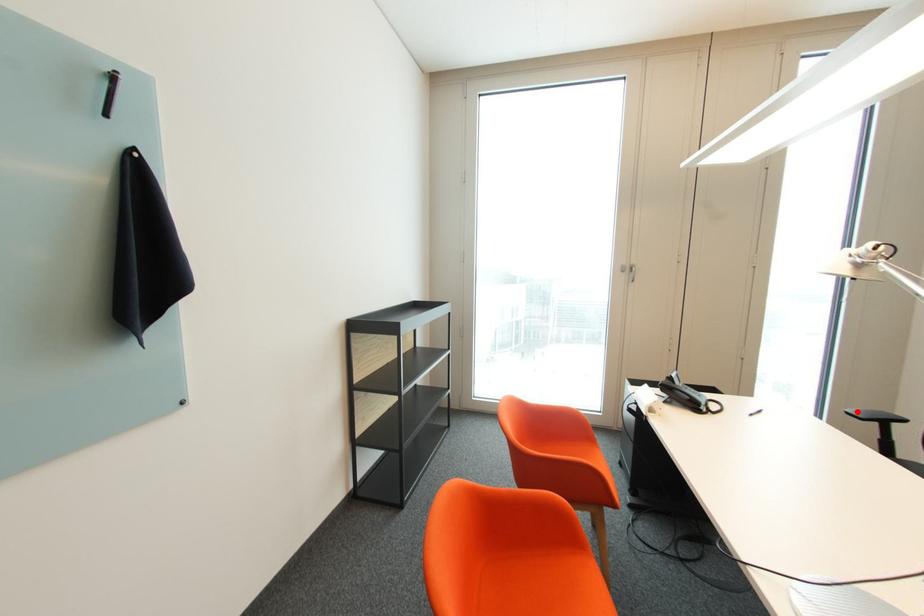
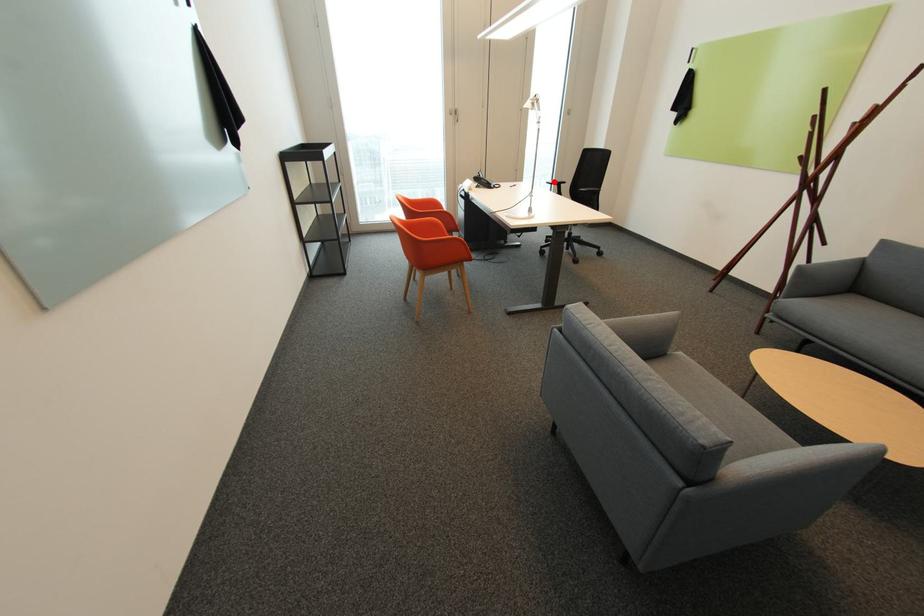
I am providing you with two images of the same scene from different viewpoints. A red point is marked on the first image and another point is marked on the second image. Is the red point in image1 aligned with the point shown in image2?

Yes